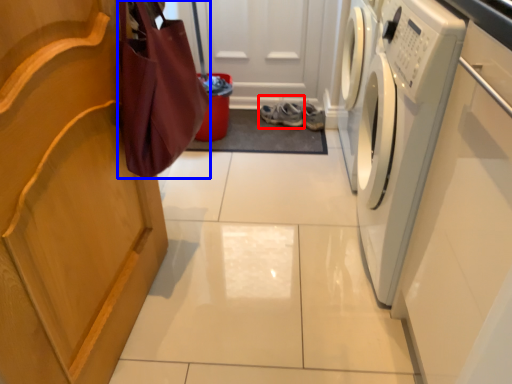
Question: Among these objects, which one is farthest to the camera, footwear (highlighted by a red box) or shopping bag (highlighted by a blue box)?

Choices:
 (A) footwear
 (B) shopping bag

Answer: (A)